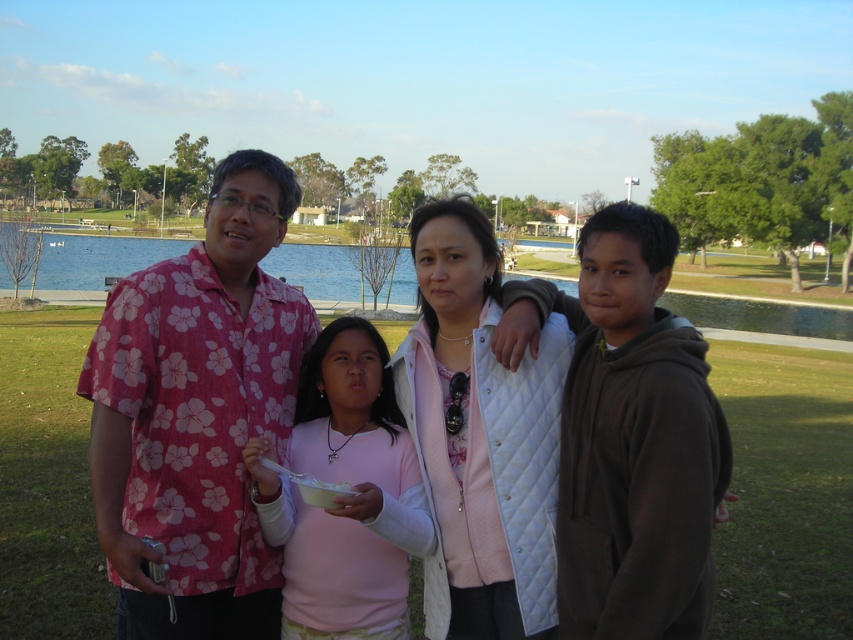
You are a photographer trying to capture a group photo of the two adults and two children in the park. You notice the pink floral shirt at center and the pink floral shirt at left. Which adult should move forward to ensure both are visible in the frame?

The pink floral shirt at center should move forward because it is positioned under the pink floral shirt at left, so moving forward would help both adults be visible in the frame.

You are an observer standing in the park and see the white quilted vest at center and the green water at center. Which object is narrower in width?

The white quilted vest at center has a lesser width compared to the green water at center, so the white quilted vest at center is narrower in width.

You are standing in the park and see the white quilted vest at center and the green water at center. Which object is nearer to you?

The white quilted vest at center is closer to the viewer than the green water at center.